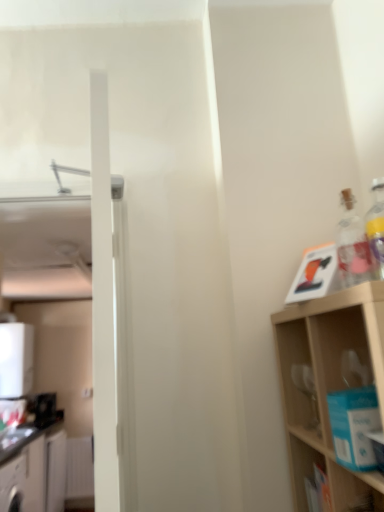
Question: Is wooden shelf at right surrounded by black plastic toaster at left, the second appliance when ordered from top to bottom?

Choices:
 (A) yes
 (B) no

Answer: (B)

Question: From a real-world perspective, is black plastic toaster at left, arranged as the first appliance when ordered from the bottom, below wooden shelf at right?

Choices:
 (A) no
 (B) yes

Answer: (B)

Question: From the image's perspective, would you say black plastic toaster at left, the second appliance when ordered from top to bottom, is shown under wooden shelf at right?

Choices:
 (A) yes
 (B) no

Answer: (A)

Question: Can you confirm if black plastic toaster at left, arranged as the first appliance when ordered from the bottom, is positioned to the right of wooden shelf at right?

Choices:
 (A) no
 (B) yes

Answer: (A)

Question: Could you tell me if black plastic toaster at left, arranged as the first appliance when ordered from the bottom, is facing wooden shelf at right?

Choices:
 (A) no
 (B) yes

Answer: (A)

Question: From a real-world perspective, relative to wooden shelf at right, is white glossy cabinet at lower left, the first cabinetry viewed from the front, vertically above or below?

Choices:
 (A) below
 (B) above

Answer: (A)

Question: Relative to wooden shelf at right, is white glossy cabinet at lower left, the first cabinetry viewed from the front, in front or behind?

Choices:
 (A) behind
 (B) front

Answer: (A)

Question: Does point (21, 494) appear closer or farther from the camera than point (306, 303)?

Choices:
 (A) closer
 (B) farther

Answer: (B)

Question: Do you think white glossy cabinet at lower left, the first cabinetry viewed from the front, is within wooden shelf at right, or outside of it?

Choices:
 (A) inside
 (B) outside

Answer: (B)

Question: Is wooden shelf at right taller or shorter than transparent glass bottle at upper right?

Choices:
 (A) short
 (B) tall

Answer: (B)

Question: Is wooden shelf at right wider or thinner than transparent glass bottle at upper right?

Choices:
 (A) thin
 (B) wide

Answer: (B)

Question: Is point tap(352, 488) positioned closer to the camera than point tap(362, 251)?

Choices:
 (A) farther
 (B) closer

Answer: (A)

Question: From a real-world perspective, relative to transparent glass bottle at upper right, is wooden shelf at right vertically above or below?

Choices:
 (A) below
 (B) above

Answer: (A)

Question: Is black plastic toaster at left, arranged as the first appliance when ordered from the bottom, in front of or behind white glossy cabinet at lower left, the second cabinetry when ordered from front to back, in the image?

Choices:
 (A) behind
 (B) front

Answer: (A)

Question: Does point (36, 406) appear closer or farther from the camera than point (28, 450)?

Choices:
 (A) closer
 (B) farther

Answer: (B)